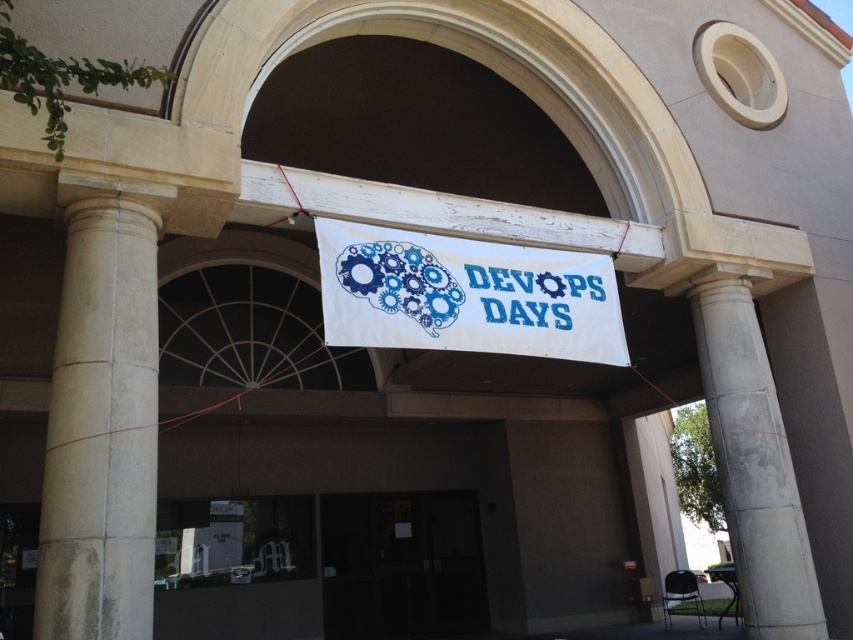
Question: Which object appears closest to the camera in this image?

Choices:
 (A) white concrete pillar at right
 (B) white stone column at left
 (C) white fabric banner at center

Answer: (B)

Question: Observing the image, what is the correct spatial positioning of white stone column at left in reference to white fabric banner at center?

Choices:
 (A) above
 (B) below

Answer: (B)

Question: Can you confirm if white concrete pillar at right is smaller than transparent glass door at center?

Choices:
 (A) yes
 (B) no

Answer: (A)

Question: Does white stone column at left appear on the left side of transparent glass door at center?

Choices:
 (A) no
 (B) yes

Answer: (B)

Question: Which of these objects is positioned closest to the white stone column at left?

Choices:
 (A) transparent glass door at center
 (B) white fabric banner at center
 (C) white concrete pillar at right

Answer: (B)

Question: Which of the following is the farthest from the observer?

Choices:
 (A) (537, 305)
 (B) (763, 616)
 (C) (90, 547)

Answer: (B)